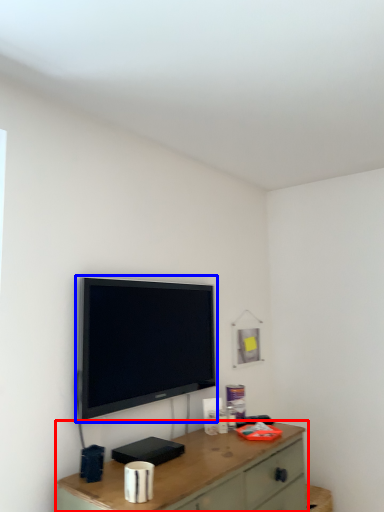
Question: Which object appears farthest to the camera in this image, desk (highlighted by a red box) or television (highlighted by a blue box)?

Choices:
 (A) desk
 (B) television

Answer: (B)